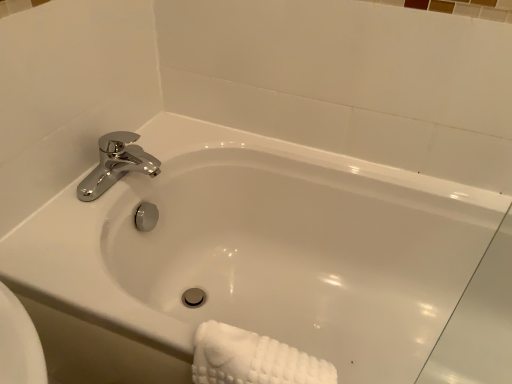
Question: Can you see chrome metallic faucet at upper left touching white textured towel at lower right?

Choices:
 (A) yes
 (B) no

Answer: (B)

Question: Does chrome metallic faucet at upper left appear on the right side of white textured towel at lower right?

Choices:
 (A) no
 (B) yes

Answer: (A)

Question: Can you confirm if chrome metallic faucet at upper left is thinner than white textured towel at lower right?

Choices:
 (A) no
 (B) yes

Answer: (A)

Question: Is the position of chrome metallic faucet at upper left less distant than that of white textured towel at lower right?

Choices:
 (A) yes
 (B) no

Answer: (B)

Question: From the image's perspective, is chrome metallic faucet at upper left beneath white textured towel at lower right?

Choices:
 (A) no
 (B) yes

Answer: (A)

Question: Could you tell me if chrome metallic faucet at upper left is turned towards white textured towel at lower right?

Choices:
 (A) no
 (B) yes

Answer: (A)

Question: Would you consider white textured towel at lower right to be distant from chrome metallic faucet at upper left?

Choices:
 (A) no
 (B) yes

Answer: (A)

Question: Does white textured towel at lower right have a larger size compared to chrome metallic faucet at upper left?

Choices:
 (A) no
 (B) yes

Answer: (B)

Question: Is white textured towel at lower right looking in the opposite direction of chrome metallic faucet at upper left?

Choices:
 (A) yes
 (B) no

Answer: (B)

Question: Is white textured towel at lower right to the right of chrome metallic faucet at upper left from the viewer's perspective?

Choices:
 (A) yes
 (B) no

Answer: (A)

Question: Considering the relative sizes of white textured towel at lower right and chrome metallic faucet at upper left in the image provided, is white textured towel at lower right wider than chrome metallic faucet at upper left?

Choices:
 (A) no
 (B) yes

Answer: (A)

Question: Does white textured towel at lower right have a lesser width compared to chrome metallic faucet at upper left?

Choices:
 (A) yes
 (B) no

Answer: (A)

Question: Is white glossy bathtub at center to the right of chrome metallic faucet at upper left from the viewer's perspective?

Choices:
 (A) no
 (B) yes

Answer: (B)